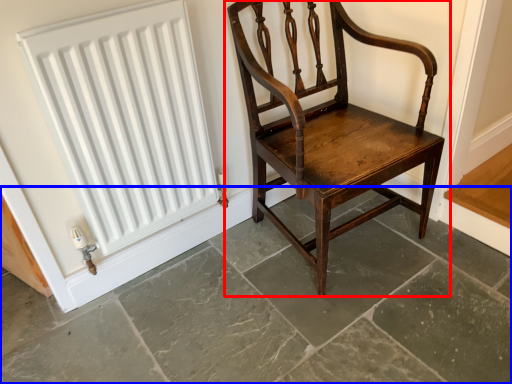
Question: Which object appears closest to the camera in this image, chair (highlighted by a red box) or concrete (highlighted by a blue box)?

Choices:
 (A) chair
 (B) concrete

Answer: (B)